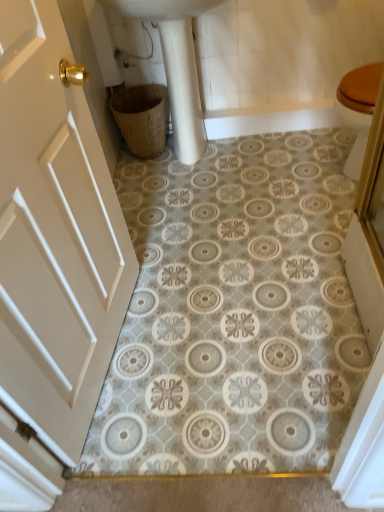
Question: Looking at the image, does woven brown basket at lower left seem bigger or smaller compared to white matte door at left?

Choices:
 (A) small
 (B) big

Answer: (A)

Question: From the image's perspective, is woven brown basket at lower left positioned above or below white matte door at left?

Choices:
 (A) below
 (B) above

Answer: (B)

Question: Which is farther from the white matte door at left?

Choices:
 (A) woven brown basket at lower left
 (B) white glossy sink at upper center

Answer: (A)

Question: Estimate the real-world distances between objects in this image. Which object is closer to the white matte door at left?

Choices:
 (A) woven brown basket at lower left
 (B) white glossy sink at upper center

Answer: (B)